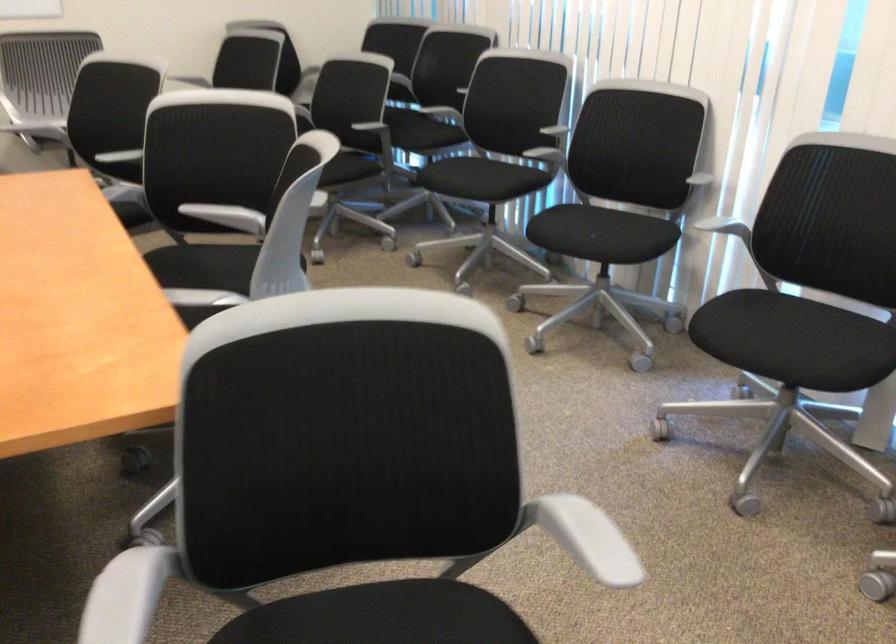
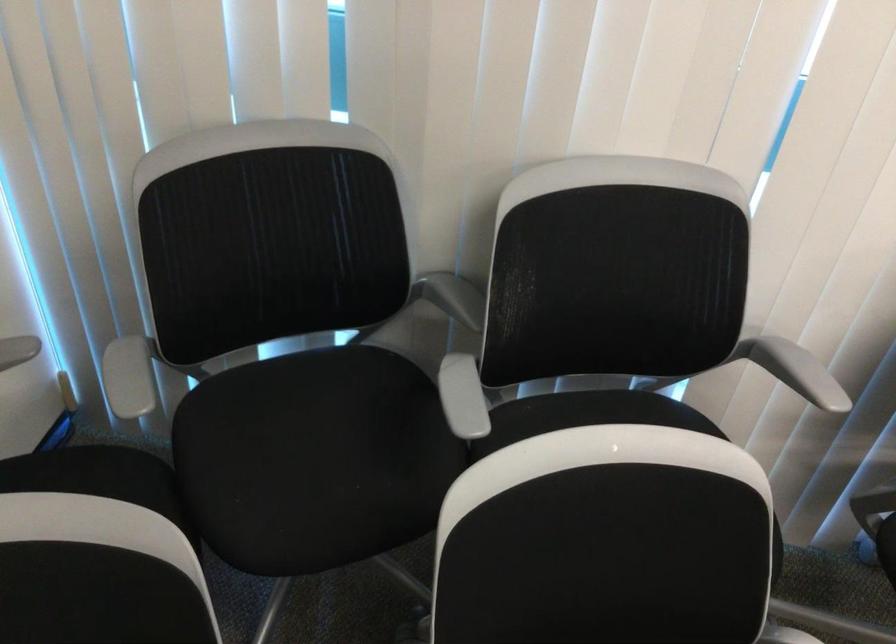
Find the pixel in the second image that matches (472,84) in the first image.

(794, 370)